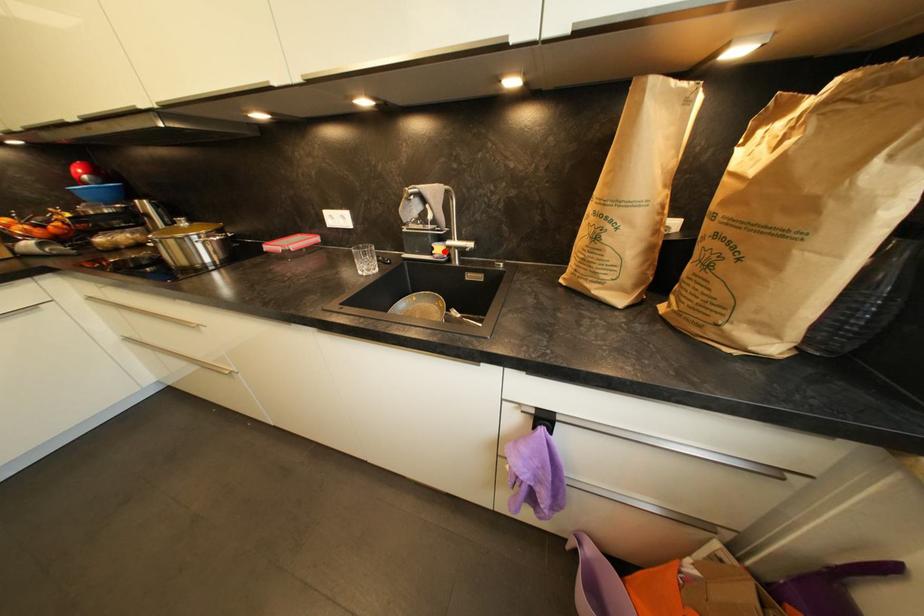
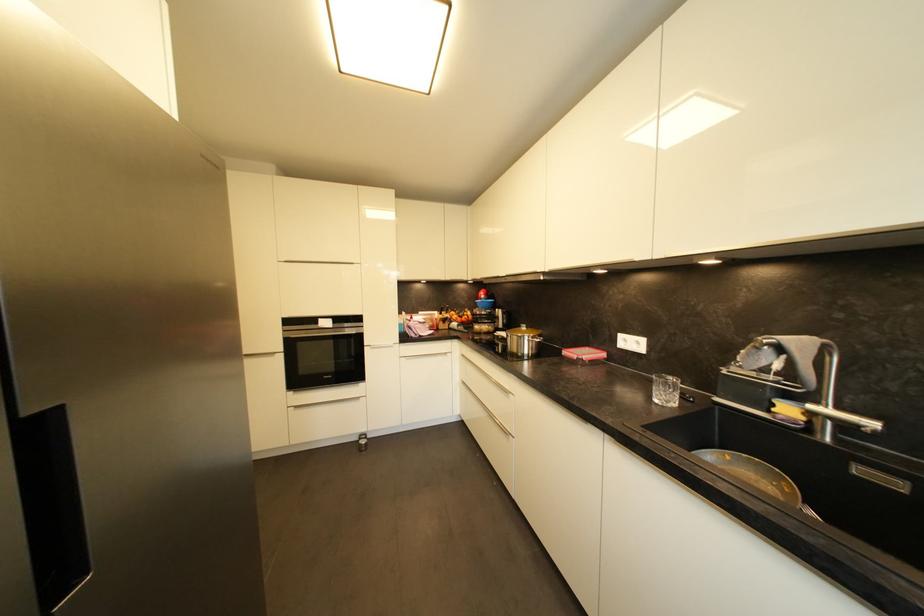
Where in the second image is the point corresponding to the highlighted location from the first image?

(793, 411)